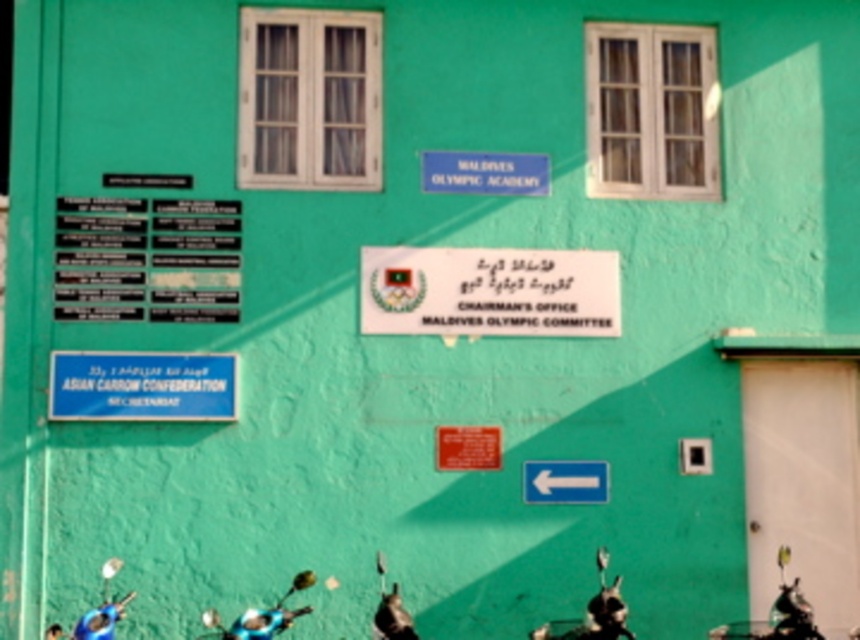
You are standing in front of the building and want to park your car between the shiny chrome motorcycle at lower center and the blue matte motorcycle at lower center. Is there enough space between them for your car?

The shiny chrome motorcycle at lower center is further to the viewer than the blue matte motorcycle at lower center, so there is space between them. However, the exact distance isn not provided, so it depends on the car size.

You are a visitor arriving at the building and want to park your car. The shiny chrome motorcycle at lower center and the blue matte motorcycle at lower center are blocking the entrance. Which motorcycle should you move to allow your car to pass through the entrance?

You should move the shiny chrome motorcycle at lower center because it is below the blue matte motorcycle at lower center, meaning it is closer to the entrance and blocking the path more directly.

You are a delivery person who needs to park your 3.5 feet wide motorcycle between the shiny chrome motorcycle at lower center and the blue matte motorcycle at lower center. Can you fit your motorcycle there?

The distance between the shiny chrome motorcycle at lower center and the blue matte motorcycle at lower center is 5.20 feet. Since your motorcycle is 3.5 feet wide, there is enough space to park it between them.